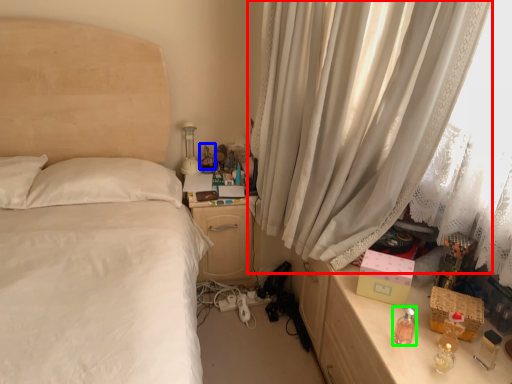
Question: Which is farther away from curtain (highlighted by a red box)? toy (highlighted by a blue box) or perfume (highlighted by a green box)?

Choices:
 (A) toy
 (B) perfume

Answer: (A)